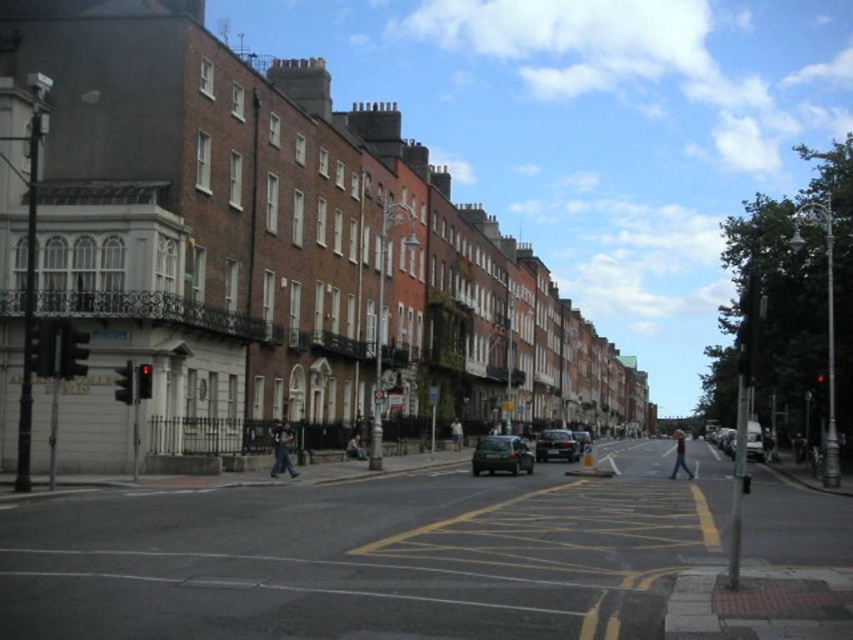
Is metallic silver car at center shorter than shiny black car at center?

Indeed, metallic silver car at center has a lesser height compared to shiny black car at center.

Between point (479, 438) and point (535, 456), which one is positioned in front?

Point (535, 456)

Is point (515, 444) positioned in front of point (572, 444)?

Yes, point (515, 444) is closer to viewer.

Locate an element on the screen. The image size is (853, 640). metallic silver car at center is located at coordinates (502, 456).

Who is more distant from viewer, (281, 429) or (355, 442)?

The point (355, 442) is more distant.

Is point (276, 476) farther from viewer compared to point (354, 436)?

That is False.

Locate an element on the screen. dark blue jeans at center is located at coordinates (282, 451).

Is dark blue jeans at center bigger than light blue jeans at center?

Actually, dark blue jeans at center might be smaller than light blue jeans at center.

Measure the distance between dark blue jeans at center and camera.

They are 31.80 meters apart.

Does point (288, 440) come in front of point (683, 454)?

Yes.

You are a GUI agent. You are given a task and a screenshot of the screen. Output one action in this format:
    pyautogui.click(x=<x>, y=<y>)
    Task: Click on the dark blue jeans at center
    This screenshot has width=853, height=640.
    Given the screenshot: What is the action you would take?
    pos(282,451)